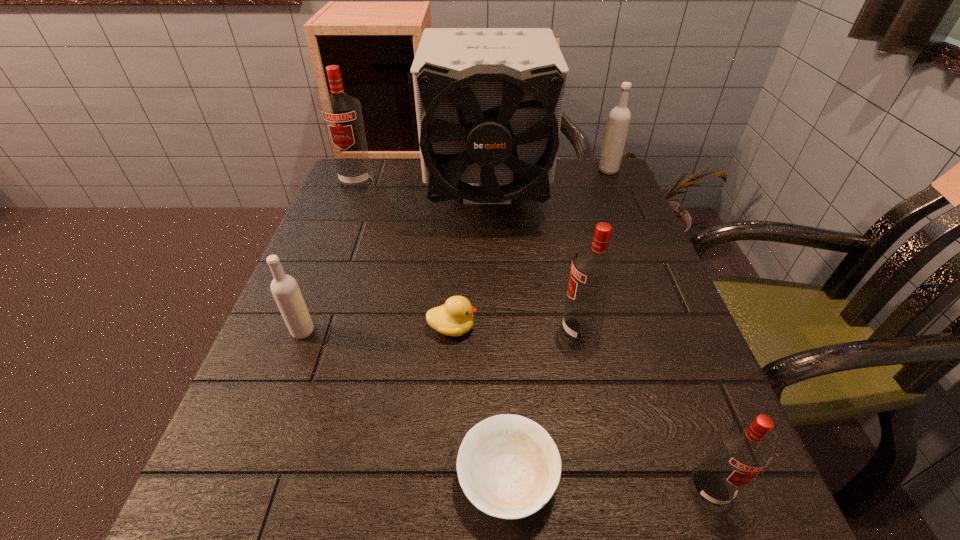
You are a GUI agent. You are given a task and a screenshot of the screen. Output one action in this format:
    pyautogui.click(x=<x>, y=<y>)
    Task: Click on the smallest red vodka
    The height and width of the screenshot is (540, 960).
    Given the screenshot: What is the action you would take?
    pyautogui.click(x=741, y=451)

Locate an element on the screen. The width and height of the screenshot is (960, 540). the rightmost red vodka is located at coordinates tap(741, 451).

You are a GUI agent. You are given a task and a screenshot of the screen. Output one action in this format:
    pyautogui.click(x=<x>, y=<y>)
    Task: Click on the duckling
    The width and height of the screenshot is (960, 540).
    Given the screenshot: What is the action you would take?
    pyautogui.click(x=455, y=318)

The image size is (960, 540). Identify the location of the second shortest object. (455, 318).

Find the location of a particular element. the shortest object is located at coordinates (508, 466).

Where is `beige bowl`? The image size is (960, 540). beige bowl is located at coordinates (508, 466).

The height and width of the screenshot is (540, 960). I want to click on blank space located 0.120m on the right of the gray fan, so click(591, 197).

Locate an element on the screen. This screenshot has height=540, width=960. free space located on the front label of the farthest red vodka is located at coordinates (328, 257).

The height and width of the screenshot is (540, 960). I want to click on free location located on the left of the farther white vodka, so click(494, 171).

Where is `free space located 0.250m on the front label of the third vodka from right to left`? Image resolution: width=960 pixels, height=540 pixels. free space located 0.250m on the front label of the third vodka from right to left is located at coordinates (423, 332).